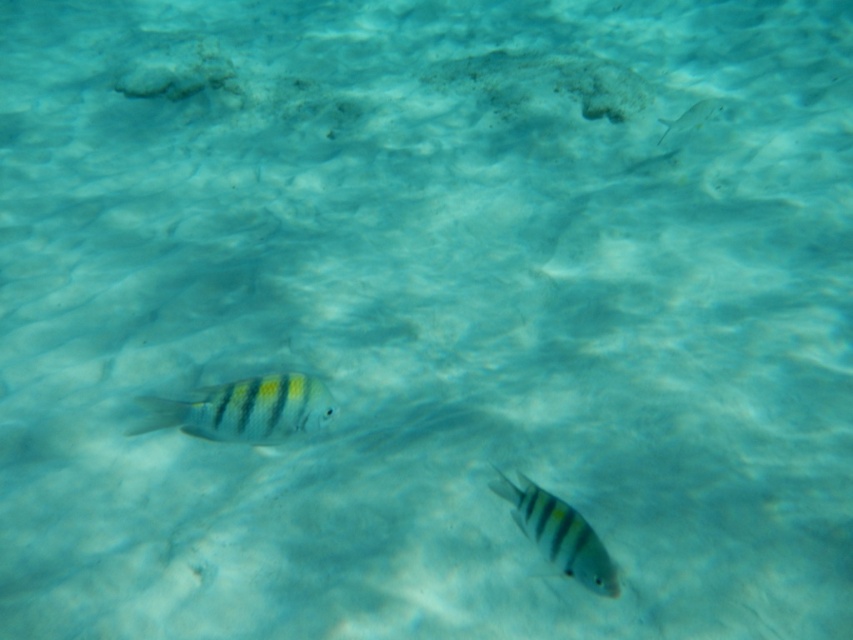
Question: Which of the following is the farthest from the observer?

Choices:
 (A) (560, 522)
 (B) (262, 385)
 (C) (664, 131)

Answer: (C)

Question: Where is yellow striped fish at center located in relation to translucent white fish at upper right in the image?

Choices:
 (A) below
 (B) above

Answer: (A)

Question: Is yellow-green striped fish at lower left to the right of translucent white fish at upper right from the viewer's perspective?

Choices:
 (A) no
 (B) yes

Answer: (A)

Question: Among these points, which one is farthest from the camera?

Choices:
 (A) tap(666, 134)
 (B) tap(169, 419)
 (C) tap(579, 548)

Answer: (A)

Question: Which point is farther to the camera?

Choices:
 (A) tap(666, 122)
 (B) tap(292, 372)

Answer: (A)

Question: Can you confirm if yellow-green striped fish at lower left is bigger than translucent white fish at upper right?

Choices:
 (A) no
 (B) yes

Answer: (A)